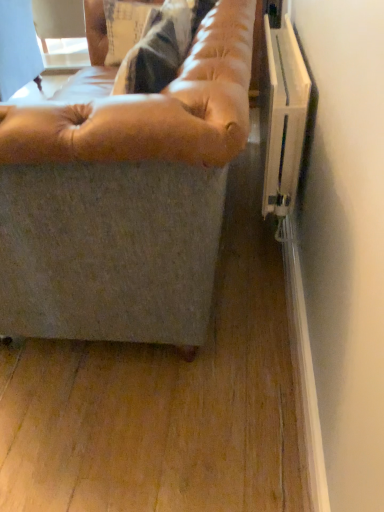
Question: Considering their positions, is leather-like tan couch at center located in front of or behind leather-like tan bean bag at center?

Choices:
 (A) behind
 (B) front

Answer: (B)

Question: Considering the positions of leather-like tan couch at center and leather-like tan bean bag at center in the image, is leather-like tan couch at center taller or shorter than leather-like tan bean bag at center?

Choices:
 (A) short
 (B) tall

Answer: (B)

Question: Based on their sizes in the image, would you say leather-like tan couch at center is bigger or smaller than leather-like tan bean bag at center?

Choices:
 (A) small
 (B) big

Answer: (B)

Question: From their relative heights in the image, would you say leather-like tan bean bag at center is taller or shorter than leather-like tan couch at center?

Choices:
 (A) tall
 (B) short

Answer: (B)

Question: Which is correct: leather-like tan bean bag at center is inside leather-like tan couch at center, or outside of it?

Choices:
 (A) outside
 (B) inside

Answer: (B)

Question: In terms of size, does leather-like tan bean bag at center appear bigger or smaller than leather-like tan couch at center?

Choices:
 (A) big
 (B) small

Answer: (B)

Question: From the image's perspective, is leather-like tan bean bag at center positioned above or below leather-like tan couch at center?

Choices:
 (A) below
 (B) above

Answer: (A)